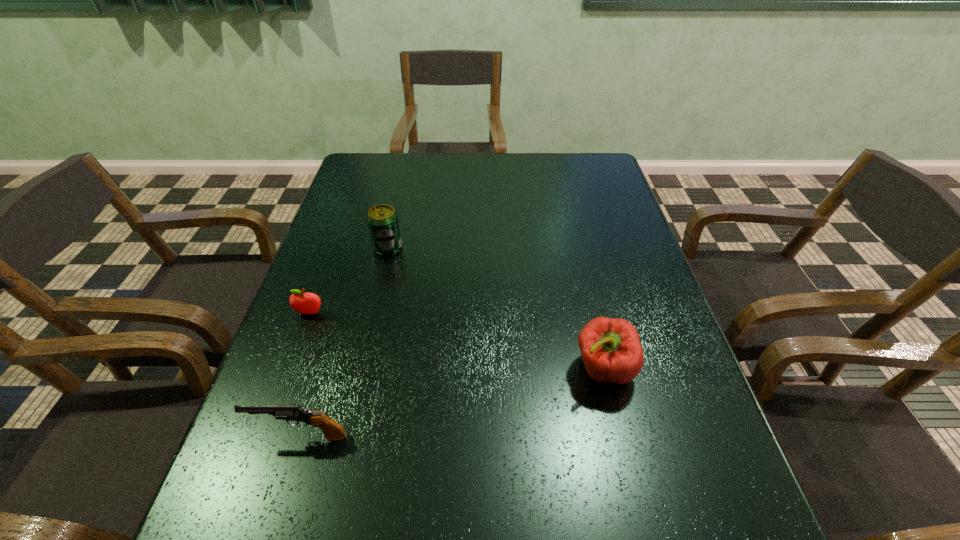
At what (x,y) coordinates should I click in order to perform the action: click on gun located in the left edge section of the desktop. Please return your answer as a coordinate pair (x, y). The height and width of the screenshot is (540, 960). Looking at the image, I should click on [x=332, y=430].

You are a GUI agent. You are given a task and a screenshot of the screen. Output one action in this format:
    pyautogui.click(x=<x>, y=<y>)
    Task: Click on the apple at the left edge
    The height and width of the screenshot is (540, 960).
    Given the screenshot: What is the action you would take?
    pyautogui.click(x=304, y=303)

I want to click on object positioned at the right edge, so click(611, 350).

Identify the location of free space at the far edge of the desktop. The width and height of the screenshot is (960, 540). [x=522, y=182].

I want to click on free space at the near edge, so click(556, 535).

Locate an element on the screen. This screenshot has width=960, height=540. vacant space at the left edge of the desktop is located at coordinates (336, 316).

In the image, there is a desktop. Identify the location of blank space at the right edge. Image resolution: width=960 pixels, height=540 pixels. (599, 268).

Where is `vacant space at the far left corner of the desktop`? Image resolution: width=960 pixels, height=540 pixels. vacant space at the far left corner of the desktop is located at coordinates (350, 171).

At what (x,y) coordinates should I click in order to perform the action: click on vacant space at the far right corner of the desktop. Please return your answer as a coordinate pair (x, y). This screenshot has width=960, height=540. Looking at the image, I should click on (589, 185).

Identify the location of unoccupied area between the farthest object and the second nearest object. (495, 308).